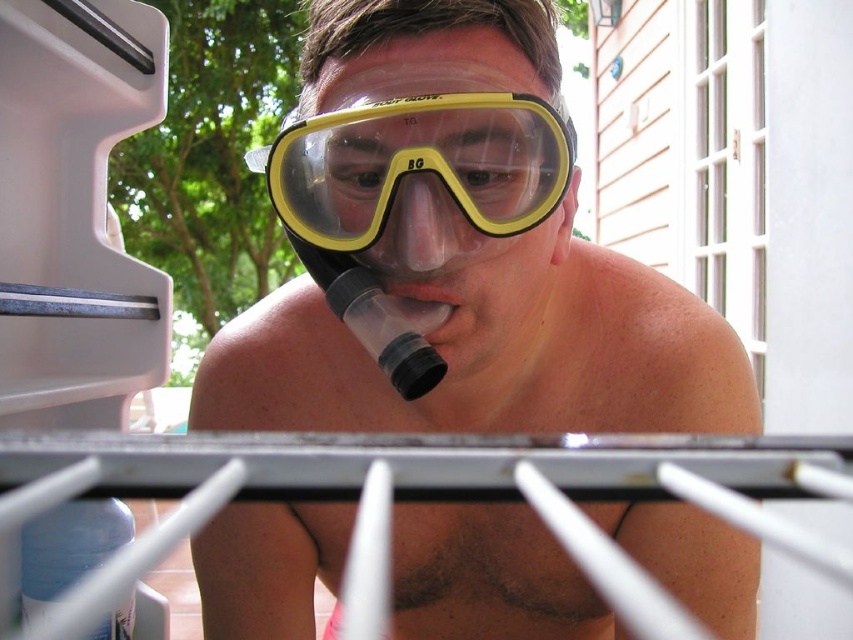
You are a professional photographer who needs to capture a closeup shot of the yellow matte snorkel mask at center and the yellow clear plastic goggles at center. Your camera has a depth of field that can focus on objects within 1 inch of each other. Can you focus on both objects simultaneously?

The yellow matte snorkel mask at center is 0.96 inches away from the yellow clear plastic goggles at center. Since the distance between them is within the 1 inch depth of field, the photographer can focus on both objects simultaneously.